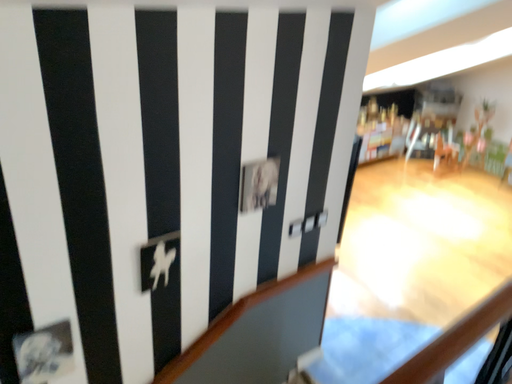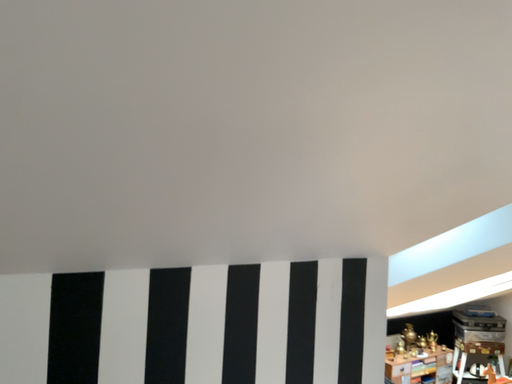
Question: How did the camera likely rotate when shooting the video?

Choices:
 (A) rotated upward
 (B) rotated downward

Answer: (A)